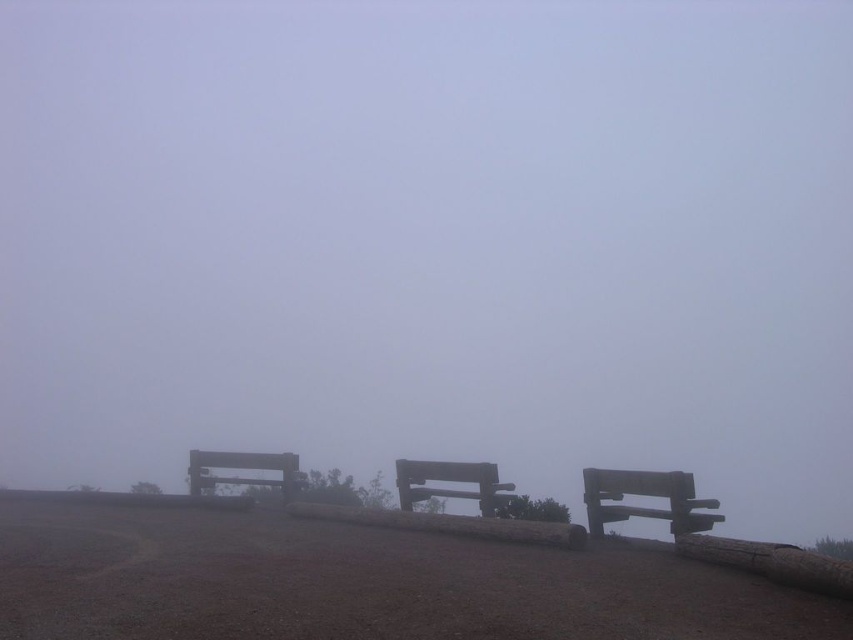
Question: Is smooth gray bench at center smaller than wooden bench at center?

Choices:
 (A) no
 (B) yes

Answer: (B)

Question: Which of the following is the closest to the observer?

Choices:
 (A) (596, 477)
 (B) (189, 483)

Answer: (A)

Question: Which object appears farthest from the camera in this image?

Choices:
 (A) wooden bench at center
 (B) wooden bench at right
 (C) smooth gray bench at center

Answer: (A)

Question: Does wooden bench at right lie behind wooden bench at center?

Choices:
 (A) yes
 (B) no

Answer: (B)

Question: Which object is closer to the camera taking this photo?

Choices:
 (A) wooden bench at right
 (B) smooth gray bench at center
 (C) wooden bench at center

Answer: (A)

Question: Does wooden bench at right have a lesser width compared to wooden bench at center?

Choices:
 (A) yes
 (B) no

Answer: (A)